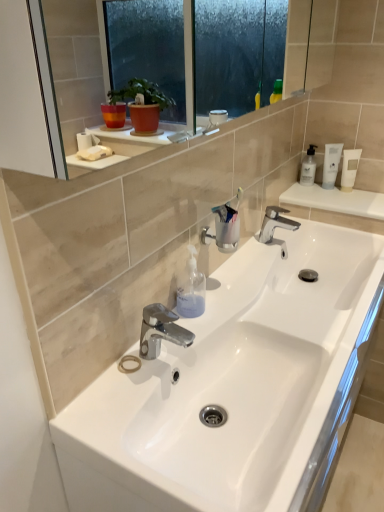
Find the location of a particular element. clear plastic cup at center is located at coordinates tap(224, 228).

Measure the distance between point (311, 163) and camera.

Point (311, 163) is 1.79 meters away from camera.

Image resolution: width=384 pixels, height=512 pixels. Find the location of `white glossy sink at center`. white glossy sink at center is located at coordinates (235, 387).

This screenshot has width=384, height=512. Describe the element at coordinates (331, 164) in the screenshot. I see `white plastic tube at upper right, which appears as the first toiletry when viewed from the right` at that location.

How much space does chrome metallic faucet at center, the second tap in the top-to-bottom sequence, occupy horizontally?

5.14 inches.

Locate an element on the screen. The image size is (384, 512). clear plastic cup at center is located at coordinates (224, 228).

Is point (301, 176) less distant than point (348, 277)?

No, it is behind (348, 277).

Based on the photo, from a real-world perspective, is white matte bottle at upper right physically below white glossy sink at center?

No, from a real-world perspective, white matte bottle at upper right is not below white glossy sink at center.

Is white matte bottle at upper right taller than white glossy sink at center?

Yes, white matte bottle at upper right is taller than white glossy sink at center.

Considering the relative sizes of white matte bottle at upper right and white glossy sink at center in the image provided, is white matte bottle at upper right thinner than white glossy sink at center?

Correct, the width of white matte bottle at upper right is less than that of white glossy sink at center.

Considering the positions of point (188, 304) and point (231, 220), is point (188, 304) closer or farther from the camera than point (231, 220)?

Point (188, 304) is closer to the camera than point (231, 220).

Locate an element on the screen. The width and height of the screenshot is (384, 512). toiletry below the clear plastic cup at center (from the image's perspective) is located at coordinates (191, 288).

From a real-world perspective, is transparent plastic soap dispenser at center, the second toiletry in the right-to-left sequence, physically located above or below clear plastic cup at center?

In terms of real-world spatial position, transparent plastic soap dispenser at center, the second toiletry in the right-to-left sequence, is below clear plastic cup at center.

Considering the positions of objects white plastic tube at upper right, the first toiletry in the top-to-bottom sequence, and polished chrome faucet at center, which ranks as the first tap in right-to-left order, in the image provided, who is in front, white plastic tube at upper right, the first toiletry in the top-to-bottom sequence, or polished chrome faucet at center, which ranks as the first tap in right-to-left order,?

Positioned in front is polished chrome faucet at center, which ranks as the first tap in right-to-left order.

Who is smaller, white plastic tube at upper right, arranged as the 2th toiletry when ordered from the bottom, or polished chrome faucet at center, the 2th tap from the left?

With smaller size is white plastic tube at upper right, arranged as the 2th toiletry when ordered from the bottom.

Is white plastic tube at upper right, the first toiletry in the top-to-bottom sequence, spatially inside polished chrome faucet at center, the 2th tap from the left, or outside of it?

white plastic tube at upper right, the first toiletry in the top-to-bottom sequence, is not inside polished chrome faucet at center, the 2th tap from the left, it's outside.

Which of these two, white plastic tube at upper right, arranged as the 2th toiletry when ordered from the bottom, or polished chrome faucet at center, the 2th tap from the bottom, stands taller?

white plastic tube at upper right, arranged as the 2th toiletry when ordered from the bottom, is taller.

Can you see clear plastic cup at center touching white matte bottle at upper right?

A: No, clear plastic cup at center is not with white matte bottle at upper right.

Who is smaller, clear plastic cup at center or white matte bottle at upper right?

Result: Smaller between the two is white matte bottle at upper right.

From the image's perspective, which is above, clear plastic cup at center or white matte bottle at upper right?

white matte bottle at upper right appears higher in the image.

From a real-world perspective, does clear plastic cup at center stand above white matte bottle at upper right?

Yes, from a real-world perspective, clear plastic cup at center is on top of white matte bottle at upper right.

From a real-world perspective, is white plastic tube at upper right, the first toiletry in the top-to-bottom sequence, positioned above or below chrome metallic faucet at center, the 2th tap viewed from the right?

white plastic tube at upper right, the first toiletry in the top-to-bottom sequence, is above chrome metallic faucet at center, the 2th tap viewed from the right.

From a real-world perspective, which toiletry is the 2nd one above the chrome metallic faucet at center, the second tap in the top-to-bottom sequence? Please provide its 2D coordinates.

[(331, 164)]

Considering the positions of objects transparent plastic soap dispenser at center, marked as the 1th toiletry in a bottom-to-top arrangement, and white plastic tube at upper right, the first toiletry in the top-to-bottom sequence, in the image provided, who is more to the right, transparent plastic soap dispenser at center, marked as the 1th toiletry in a bottom-to-top arrangement, or white plastic tube at upper right, the first toiletry in the top-to-bottom sequence,?

From the viewer's perspective, white plastic tube at upper right, the first toiletry in the top-to-bottom sequence, appears more on the right side.

From the image's perspective, who appears lower, transparent plastic soap dispenser at center, arranged as the first toiletry when viewed from the left, or white plastic tube at upper right, the 2th toiletry viewed from the left?

transparent plastic soap dispenser at center, arranged as the first toiletry when viewed from the left, is shown below in the image.

Which of these two, transparent plastic soap dispenser at center, arranged as the first toiletry when viewed from the left, or white plastic tube at upper right, which is the first toiletry in back-to-front order, stands shorter?

Standing shorter between the two is transparent plastic soap dispenser at center, arranged as the first toiletry when viewed from the left.

Considering the sizes of transparent plastic soap dispenser at center, the first toiletry positioned from the front, and white plastic tube at upper right, the first toiletry in the top-to-bottom sequence, in the image, is transparent plastic soap dispenser at center, the first toiletry positioned from the front, bigger or smaller than white plastic tube at upper right, the first toiletry in the top-to-bottom sequence,?

In the image, transparent plastic soap dispenser at center, the first toiletry positioned from the front, appears to be larger than white plastic tube at upper right, the first toiletry in the top-to-bottom sequence.

From the image's perspective, which is above, white glossy sink at center or white matte tube at upper right?

white matte tube at upper right, from the image's perspective.

In the image, there is a white matte tube at upper right. At what (x,y) coordinates should I click in order to perform the action: click on sink below it (from the image's perspective). Please return your answer as a coordinate pair (x, y). This screenshot has height=512, width=384. Looking at the image, I should click on (235, 387).

From a real-world perspective, relative to white matte tube at upper right, is white glossy sink at center vertically above or below?

From a real-world perspective, white glossy sink at center is physically below white matte tube at upper right.

Can you confirm if white glossy sink at center is positioned to the left of white matte tube at upper right?

Yes.

This screenshot has width=384, height=512. Find the location of `sink lying in front of the white matte bottle at upper right`. sink lying in front of the white matte bottle at upper right is located at coordinates (235, 387).

The image size is (384, 512). I want to click on plumbing fixture behind the transparent plastic soap dispenser at center, arranged as the second toiletry when viewed from the back, so click(x=224, y=228).

Based on their spatial positions, is white plastic tube at upper right, which is the first toiletry in back-to-front order, or polished chrome faucet at center, positioned as the 2th tap in front-to-back order, further from clear plastic cup at center?

The object further to clear plastic cup at center is white plastic tube at upper right, which is the first toiletry in back-to-front order.

Which object lies further to the anchor point polished chrome faucet at center, the 2th tap from the left, transparent plastic soap dispenser at center, arranged as the first toiletry when viewed from the left, or clear plastic cup at center?

Among the two, transparent plastic soap dispenser at center, arranged as the first toiletry when viewed from the left, is located further to polished chrome faucet at center, the 2th tap from the left.

Based on their spatial positions, is transparent plastic soap dispenser at center, arranged as the first toiletry when viewed from the left, or polished chrome faucet at center, the 2th tap from the left, closer to white matte bottle at upper right?

The object closer to white matte bottle at upper right is polished chrome faucet at center, the 2th tap from the left.

Estimate the real-world distances between objects in this image. Which object is further from clear plastic cup at center, chrome metallic faucet at center, the 2th tap viewed from the right, or white matte tube at upper right?

white matte tube at upper right is positioned further to the anchor clear plastic cup at center.

In the scene shown: Based on their spatial positions, is transparent plastic soap dispenser at center, marked as the 1th toiletry in a bottom-to-top arrangement, or chrome metallic faucet at center, the 2th tap viewed from the right, further from clear plastic cup at center?

chrome metallic faucet at center, the 2th tap viewed from the right, is positioned further to the anchor clear plastic cup at center.

Based on their spatial positions, is chrome metallic faucet at center, the second tap in the top-to-bottom sequence, or white glossy sink at center closer to polished chrome faucet at center, positioned as the 1th tap in top-to-bottom order?

white glossy sink at center.

Consider the image. Which object lies further to the anchor point polished chrome faucet at center, positioned as the 1th tap in top-to-bottom order, chrome metallic faucet at center, the second tap in the top-to-bottom sequence, or transparent plastic soap dispenser at center, arranged as the first toiletry when viewed from the left?

chrome metallic faucet at center, the second tap in the top-to-bottom sequence, is positioned further to the anchor polished chrome faucet at center, positioned as the 1th tap in top-to-bottom order.

When comparing their distances from white matte tube at upper right, does white plastic tube at upper right, which is the first toiletry in back-to-front order, or white matte bottle at upper right seem further?

white matte bottle at upper right is positioned further to the anchor white matte tube at upper right.

Locate an element on the screen. tap between clear plastic cup at center and white plastic tube at upper right, the 2th toiletry from the front, along the z-axis is located at coordinates (275, 227).

You are a GUI agent. You are given a task and a screenshot of the screen. Output one action in this format:
    pyautogui.click(x=<x>, y=<y>)
    Task: Click on the tap between clear plastic cup at center and white matte tube at upper right in the front-back direction
    The width and height of the screenshot is (384, 512).
    Given the screenshot: What is the action you would take?
    pyautogui.click(x=275, y=227)

I want to click on toiletry between white glossy sink at center and polished chrome faucet at center, which ranks as the first tap in right-to-left order, from front to back, so click(191, 288).

Find the location of a particular element. This screenshot has height=512, width=384. plumbing fixture between chrome metallic faucet at center, positioned as the 1th tap in left-to-right order, and white plastic tube at upper right, the 2th toiletry from the front, in the front-back direction is located at coordinates (224, 228).